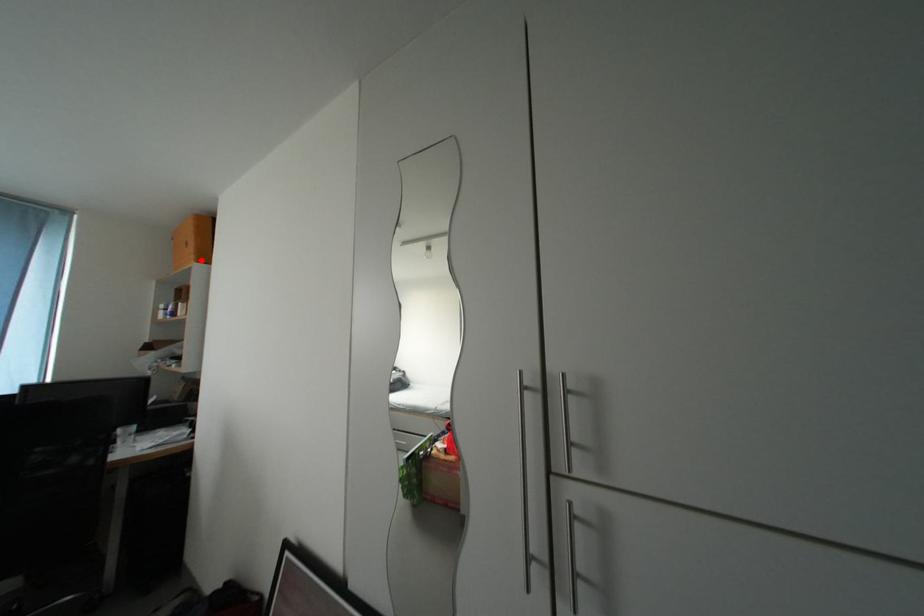
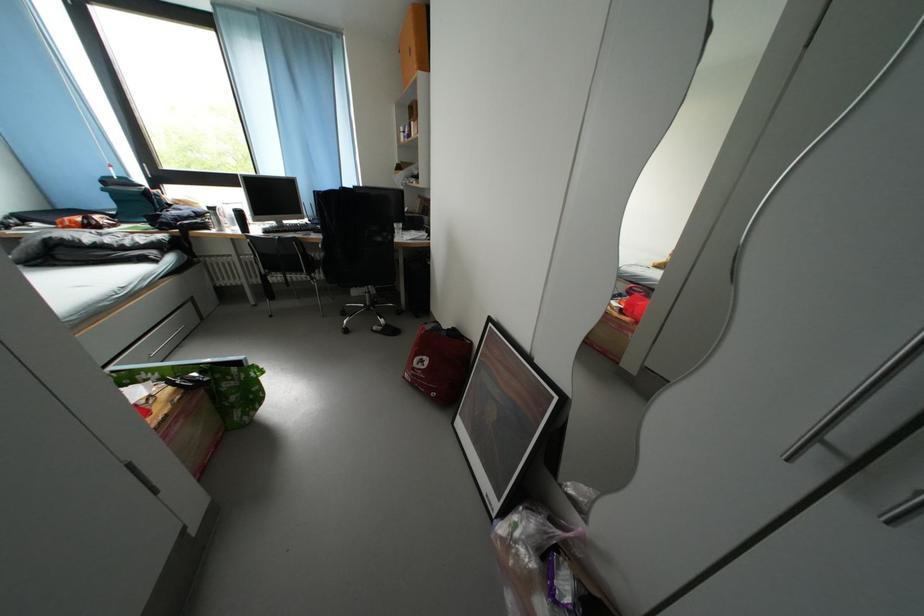
Question: I am providing you with two images of the same scene from different viewpoints. A red point is marked on the first image. Can you still see the location of the red point in image 2?

Choices:
 (A) Yes
 (B) No

Answer: (A)